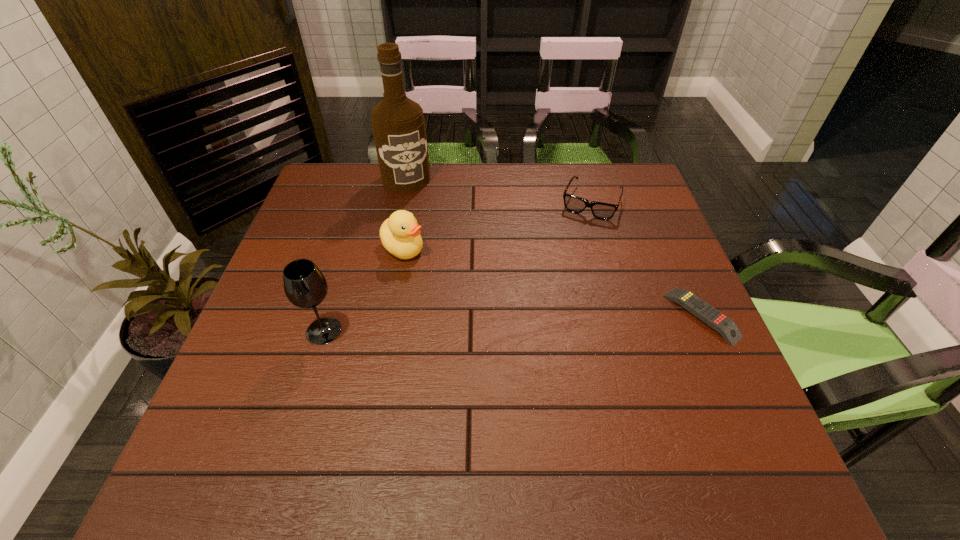
Find the location of a particular element. free space on the desktop that is between the fourth shortest object and the remote control and is positioned at the beak of the duck is located at coordinates (490, 324).

You are a GUI agent. You are given a task and a screenshot of the screen. Output one action in this format:
    pyautogui.click(x=<x>, y=<y>)
    Task: Click on the vacant space on the desktop that is between the wineglass and the shortest object and is positioned on the label of the tallest object
    
    Given the screenshot: What is the action you would take?
    pyautogui.click(x=468, y=325)

Locate an element on the screen. This screenshot has width=960, height=540. vacant space on the desktop that is between the fourth shortest object and the rightmost object and is positioned on the front-facing side of the second shortest object is located at coordinates (542, 322).